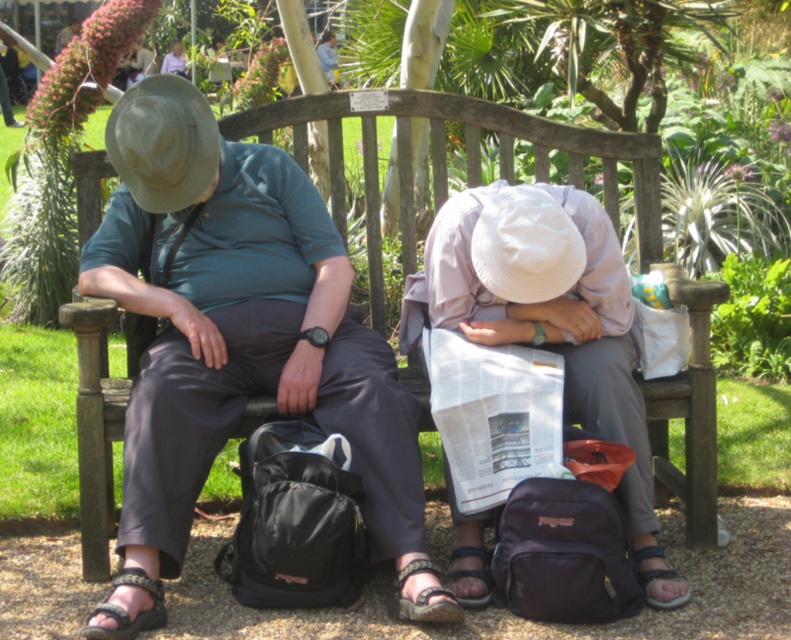
You are a photographer trying to capture a closeup of the matte gray hat at left and the white matte hat at center. Which hat should you focus on first if you want to take a photo from the ground level looking upwards?

The matte gray hat at left is located above the white matte hat at center, so you should focus on the matte gray hat at left first to capture it in the photo from the ground level looking upwards.

You are standing in the garden and want to place a small potted plant between the two points labeled point (309,250) and point (536,216). Which point should the plant be closer to in order to be nearer to the viewer?

The plant should be closer to point (309,250) because it is further to the viewer than point (536,216).

Consider the image. You are standing in the garden and want to place a small potted plant exactly at the point marked as point (239, 340). Which object is at that point?

The matte gray hat at left is located at point (239, 340).